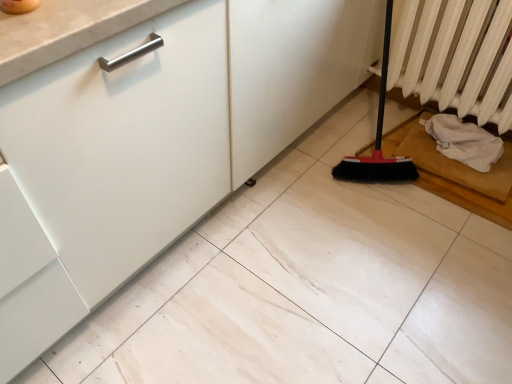
Find the location of a particular element. free space in front of white fabric at lower right is located at coordinates (472, 182).